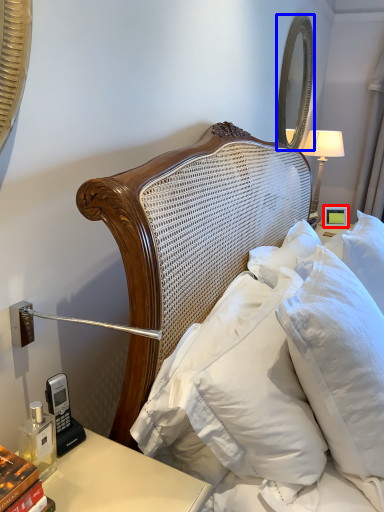
Question: Which of the following is the farthest to the observer, picture frame (highlighted by a red box) or mirror (highlighted by a blue box)?

Choices:
 (A) picture frame
 (B) mirror

Answer: (A)